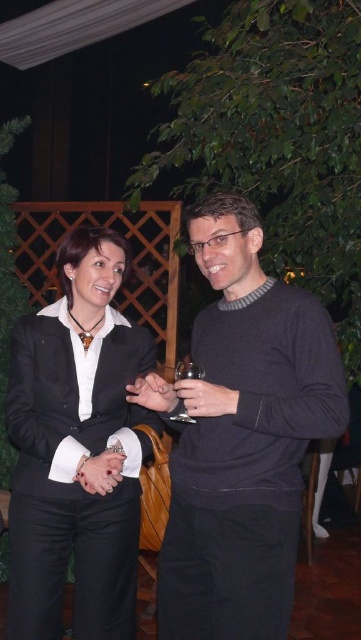
You are a photographer at a formal event. You need to capture a photo of the matte black suit at center and the transparent glass at center without any obstructions. Based on their positions, which object should you focus on first to ensure both are in frame?

The matte black suit at center is located below the transparent glass at center. To ensure both are in frame, focus on the transparent glass at center first as it is above and will be in the upper part of the photo, while the matte black suit at center will naturally be positioned below it within the same frame.